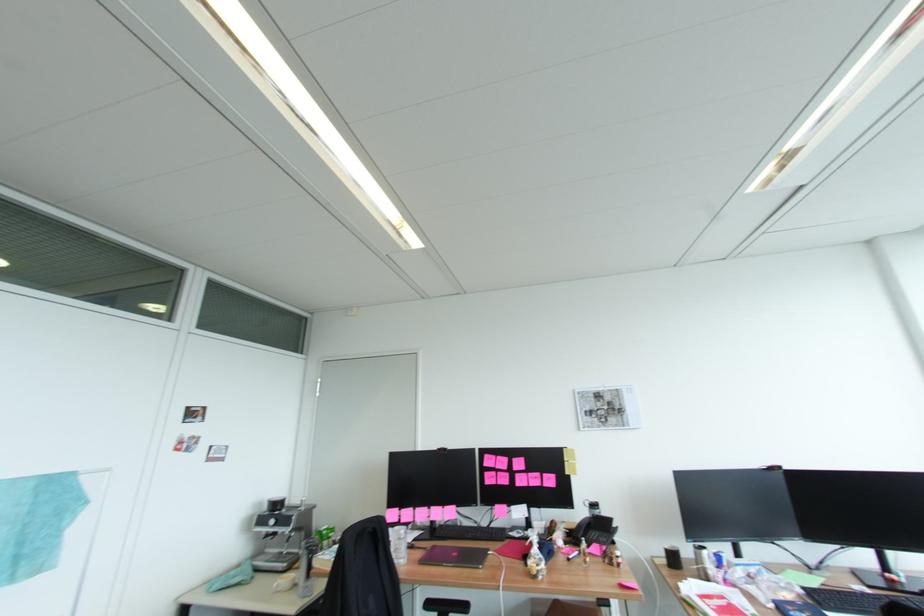
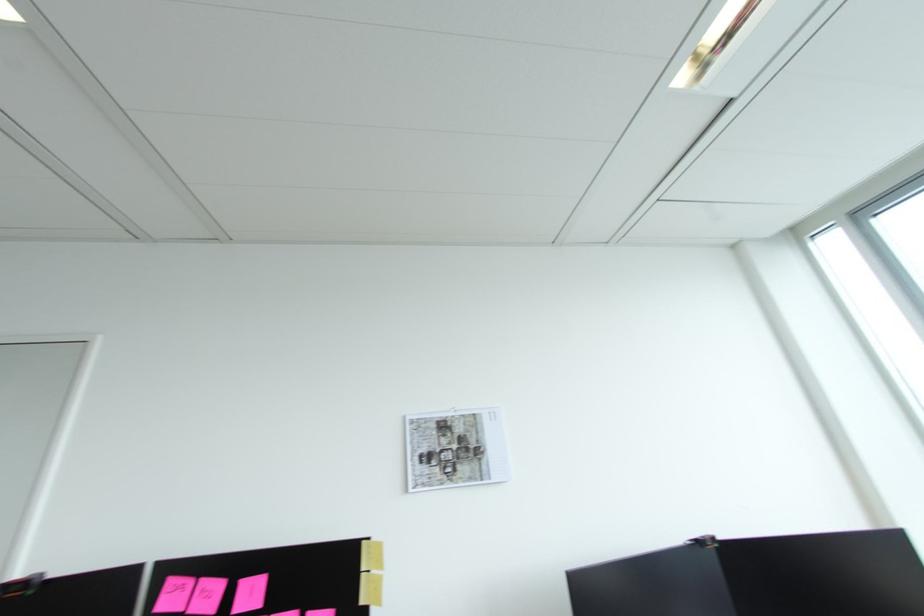
Find the pixel in the second image that matches point (507, 463) in the first image.

(213, 594)